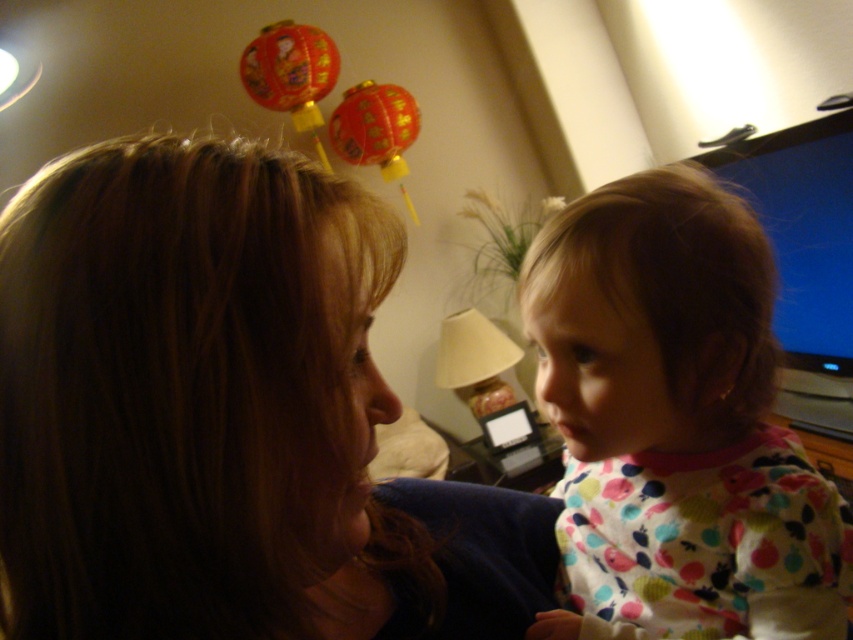
Question: Can you confirm if brown hair at upper left is thinner than polka dot pajamas at right?

Choices:
 (A) no
 (B) yes

Answer: (A)

Question: Can you confirm if brown hair at upper left is positioned to the right of polka dot pajamas at right?

Choices:
 (A) yes
 (B) no

Answer: (B)

Question: Which object is farther from the camera taking this photo?

Choices:
 (A) brown hair at upper left
 (B) polka dot pajamas at right

Answer: (B)

Question: Is brown hair at upper left positioned in front of polka dot pajamas at right?

Choices:
 (A) no
 (B) yes

Answer: (B)